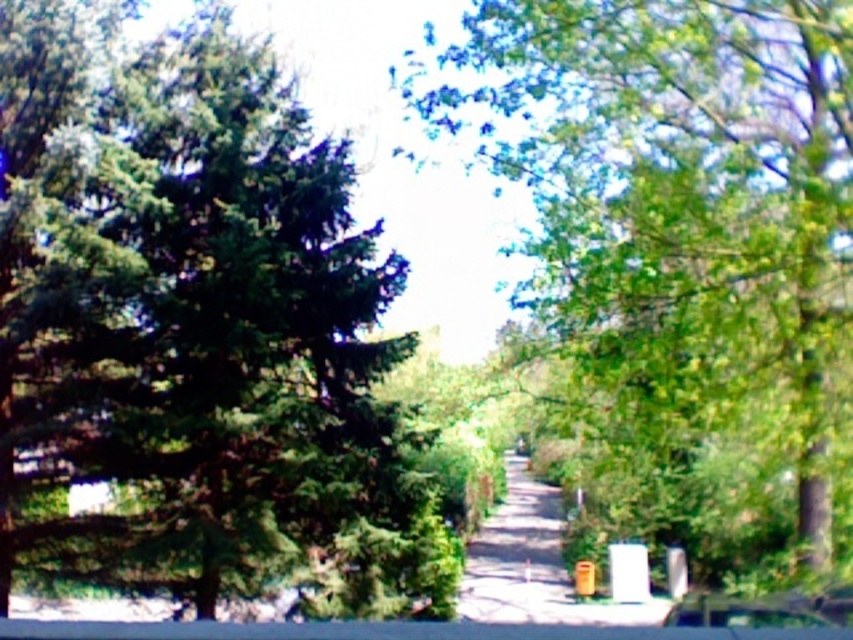
Question: Is green leafy tree at left positioned before metallic silver car at center?

Choices:
 (A) no
 (B) yes

Answer: (A)

Question: Is green leafy tree at left to the right of smooth concrete path at center from the viewer's perspective?

Choices:
 (A) no
 (B) yes

Answer: (A)

Question: Does smooth concrete path at center come behind metallic silver car at center?

Choices:
 (A) no
 (B) yes

Answer: (B)

Question: Which is farther from the green leafy tree at left?

Choices:
 (A) metallic silver car at center
 (B) green leafy tree at center
 (C) smooth concrete path at center

Answer: (C)

Question: Based on their relative distances, which object is farther from the metallic silver car at center?

Choices:
 (A) green leafy tree at center
 (B) smooth concrete path at center
 (C) green leafy tree at left

Answer: (B)

Question: Among these points, which one is farthest from the camera?

Choices:
 (A) (614, 188)
 (B) (544, 492)

Answer: (B)